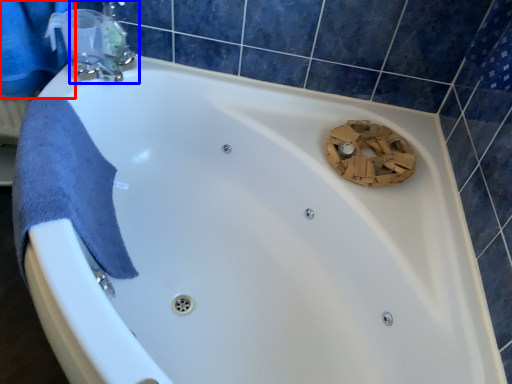
Question: Which point is closer to the camera, shower curtain (highlighted by a red box) or tap (highlighted by a blue box)?

Choices:
 (A) shower curtain
 (B) tap

Answer: (A)